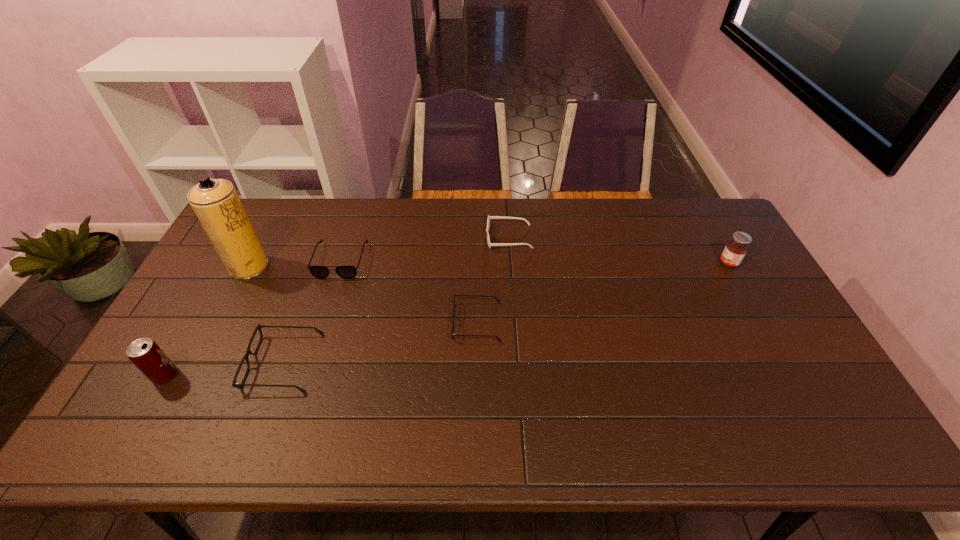
Identify which object is located as the fifth nearest to the farthest spectacles. Please provide its 2D coordinates. Your answer should be formatted as a tuple, i.e. [(x, y)], where the tuple contains the x and y coordinates of a point satisfying the conditions above.

[(144, 353)]

Point out which object is positioned as the nearest to the tallest object. Please provide its 2D coordinates. Your answer should be formatted as a tuple, i.e. [(x, y)], where the tuple contains the x and y coordinates of a point satisfying the conditions above.

[(321, 272)]

You are a GUI agent. You are given a task and a screenshot of the screen. Output one action in this format:
    pyautogui.click(x=<x>, y=<y>)
    Task: Click on the third closest spectacles to the tallest object
    
    Given the screenshot: What is the action you would take?
    pyautogui.click(x=496, y=298)

At what (x,y) coordinates should I click in order to perform the action: click on spectacles that is the second closest one to the farthest spectacles. Please return your answer as a coordinate pair (x, y). Looking at the image, I should click on (496, 298).

You are a GUI agent. You are given a task and a screenshot of the screen. Output one action in this format:
    pyautogui.click(x=<x>, y=<y>)
    Task: Click on the vacant space that satisfies the following two spatial constraints: 1. on the back side of the beer can; 2. on the right side of the tallest object
    Image resolution: width=960 pixels, height=540 pixels.
    Given the screenshot: What is the action you would take?
    pyautogui.click(x=227, y=267)

This screenshot has width=960, height=540. Find the location of `vacant space that satisfies the following two spatial constraints: 1. with the lenses of the sunglasses facing outward; 2. on the front side of the beer can`. vacant space that satisfies the following two spatial constraints: 1. with the lenses of the sunglasses facing outward; 2. on the front side of the beer can is located at coordinates (518, 375).

The height and width of the screenshot is (540, 960). What are the coordinates of `blank area in the image that satisfies the following two spatial constraints: 1. with the lenses of the sunglasses facing outward; 2. on the front-facing side of the farthest spectacles` in the screenshot? It's located at (511, 261).

This screenshot has height=540, width=960. Identify the location of free region that satisfies the following two spatial constraints: 1. with the lenses of the sunglasses facing outward; 2. on the front-facing side of the farthest spectacles. (511, 261).

Locate an element on the screen. This screenshot has height=540, width=960. free spot that satisfies the following two spatial constraints: 1. on the front-facing side of the rightmost spectacles; 2. on the front-facing side of the farthest spectacles is located at coordinates (x=477, y=261).